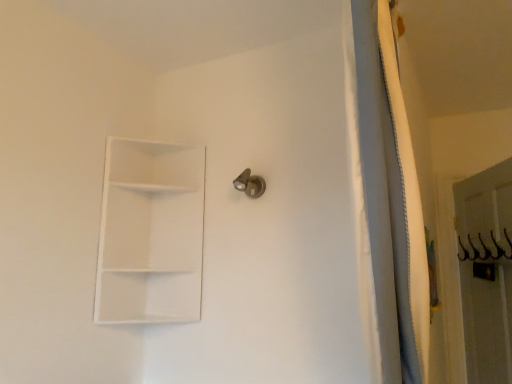
Question: In terms of width, does satin nickel door handle at upper center look wider or thinner when compared to white matte shelf at upper left?

Choices:
 (A) wide
 (B) thin

Answer: (B)

Question: From a real-world perspective, is satin nickel door handle at upper center physically located above or below white matte shelf at upper left?

Choices:
 (A) below
 (B) above

Answer: (B)

Question: From the image's perspective, is satin nickel door handle at upper center positioned above or below white matte shelf at upper left?

Choices:
 (A) below
 (B) above

Answer: (B)

Question: Is point (188, 259) positioned closer to the camera than point (250, 183)?

Choices:
 (A) farther
 (B) closer

Answer: (A)

Question: Is white matte shelf at upper left in front of or behind satin nickel door handle at upper center in the image?

Choices:
 (A) front
 (B) behind

Answer: (A)

Question: Looking at the image, does white matte shelf at upper left seem bigger or smaller compared to satin nickel door handle at upper center?

Choices:
 (A) big
 (B) small

Answer: (A)

Question: Would you say white matte shelf at upper left is to the left or to the right of satin nickel door handle at upper center in the picture?

Choices:
 (A) left
 (B) right

Answer: (A)